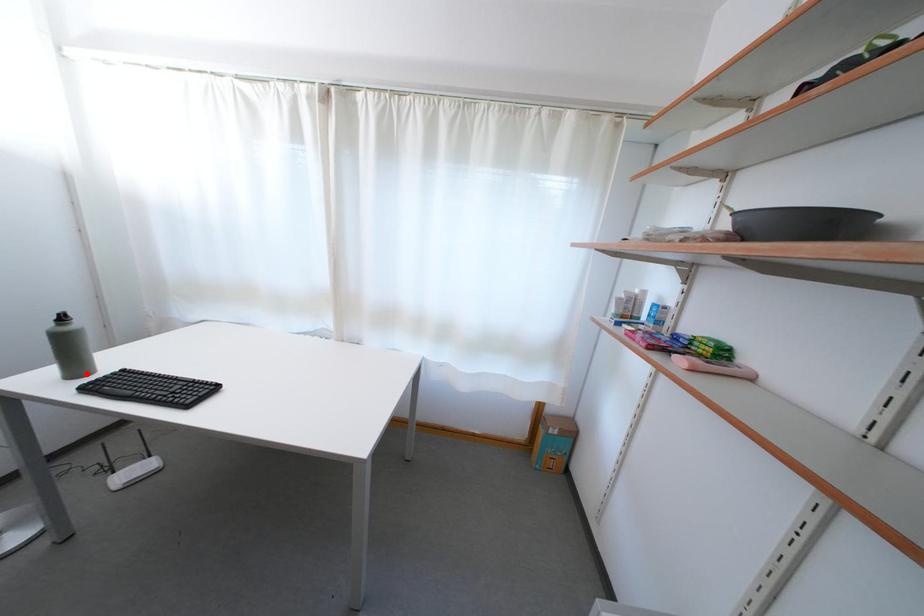
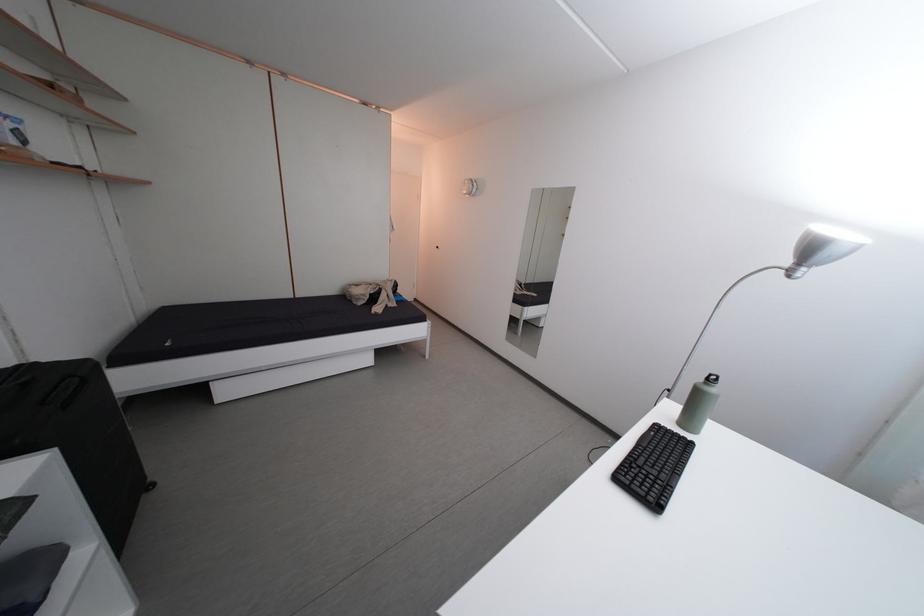
The point at the highlighted location is marked in the first image. Where is the corresponding point in the second image?

(699, 427)